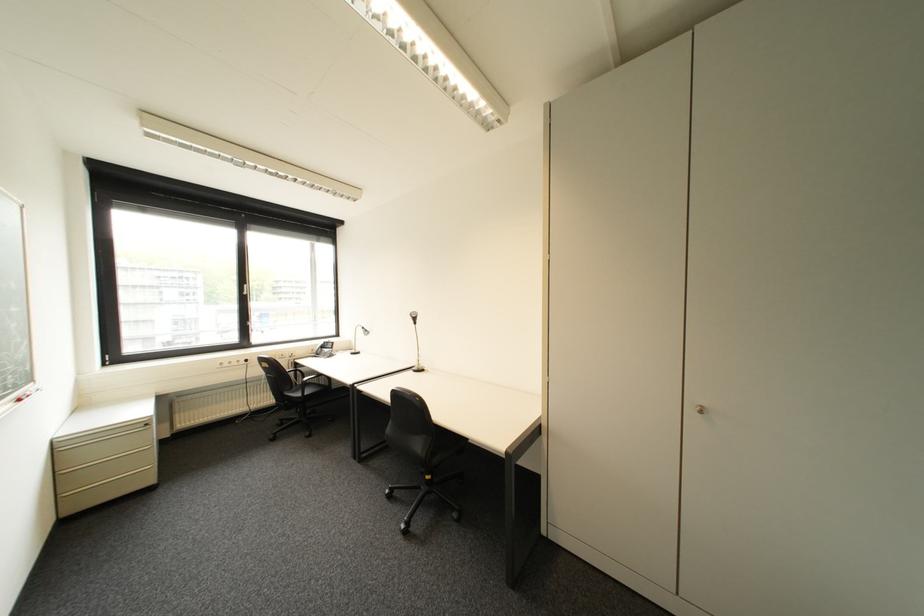
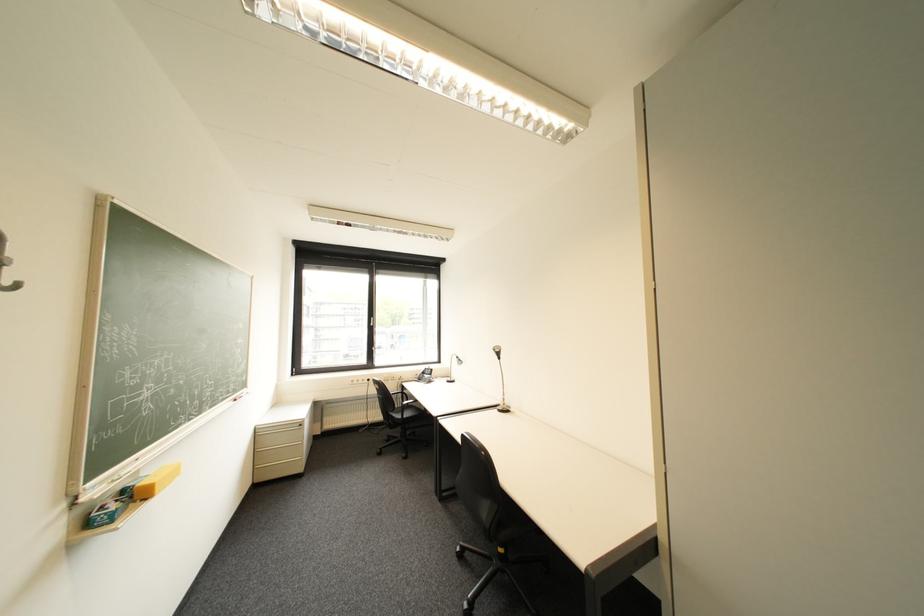
Which direction would the cameraman need to move to produce the second image?

The cameraman moved toward right, forward.